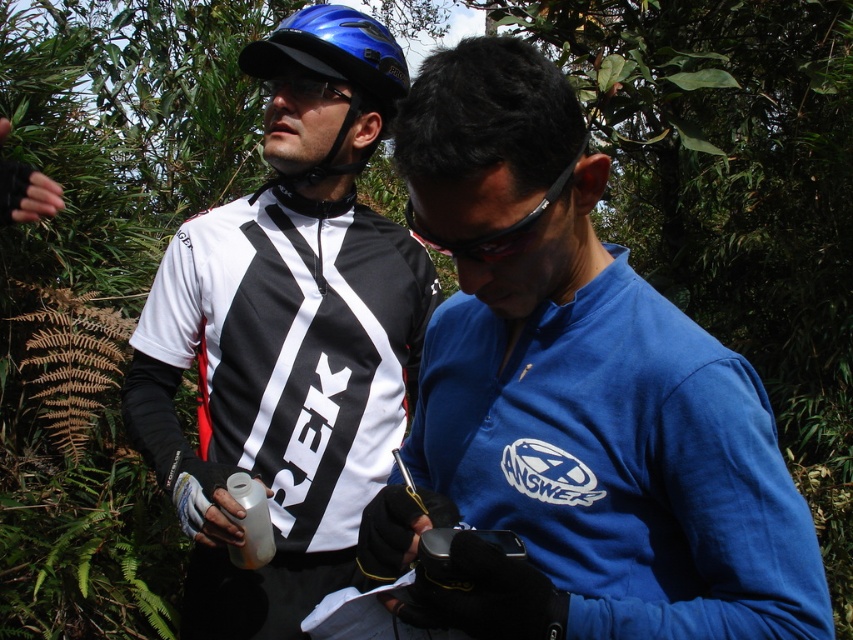
Is blue matte helmet at upper center shorter than black plastic goggles at center?

In fact, blue matte helmet at upper center may be taller than black plastic goggles at center.

Which is behind, point (253, 48) or point (451, 256)?

Point (253, 48)

Is point (387, 65) closer to camera compared to point (523, 220)?

No, (387, 65) is further to viewer.

Find the location of a particular element. blue matte helmet at upper center is located at coordinates (334, 72).

Does black plastic goggles at center appear on the left side of matte black goggles at center?

Incorrect, black plastic goggles at center is not on the left side of matte black goggles at center.

Which is behind, point (486, 248) or point (260, 84)?

The point (260, 84) is more distant.

Find the location of a particular element. black plastic goggles at center is located at coordinates (496, 228).

This screenshot has height=640, width=853. What do you see at coordinates (287, 339) in the screenshot?
I see `matte black jersey at center` at bounding box center [287, 339].

Does matte black jersey at center have a lesser width compared to blue matte helmet at upper center?

No, matte black jersey at center is not thinner than blue matte helmet at upper center.

Which is behind, point (289, 600) or point (323, 172)?

The point (323, 172) is more distant.

The image size is (853, 640). Find the location of `matte black jersey at center`. matte black jersey at center is located at coordinates (287, 339).